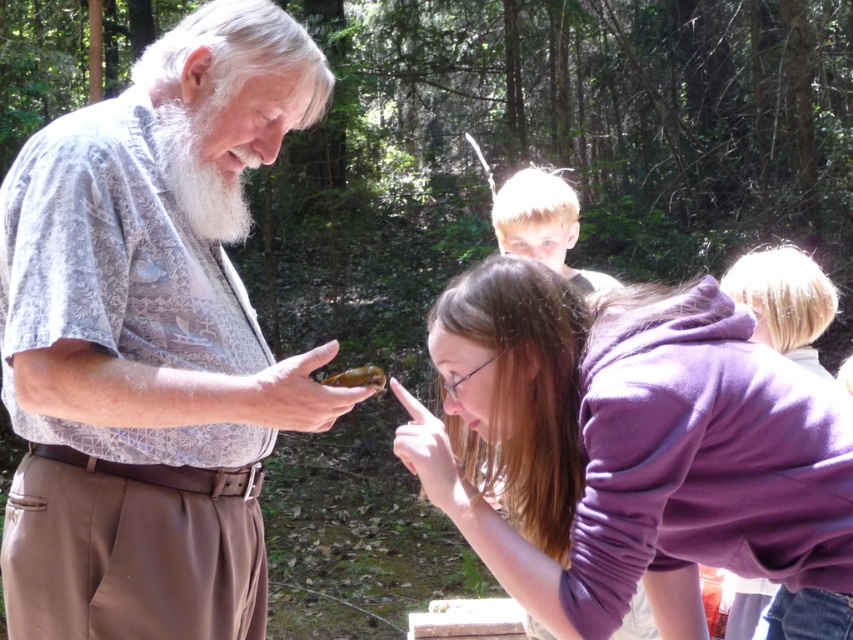
You are standing in the forest scene and need to locate the matte gray shirt at center. According to the coordinates provided, where exactly would you find it?

The matte gray shirt at center is located at point coordinates 0.534 on the x axis and 0.178 on the y axis.

You are an observer in the forest scene. You notice the purple fleece jacket at lower center and the blonde hair at upper center. Which object takes up more space in the image?

The purple fleece jacket at lower center has a larger size compared to the blonde hair at upper center, so it takes up more space in the image.

You are an artist trying to sketch the scene. You need to decide which object to draw first based on size. Since you want to start with the larger one, which object should you choose between the matte gray shirt at center and the white fluffy beard at upper left?

The matte gray shirt at center is larger in width than the white fluffy beard at upper left, so you should start by drawing the matte gray shirt at center first.